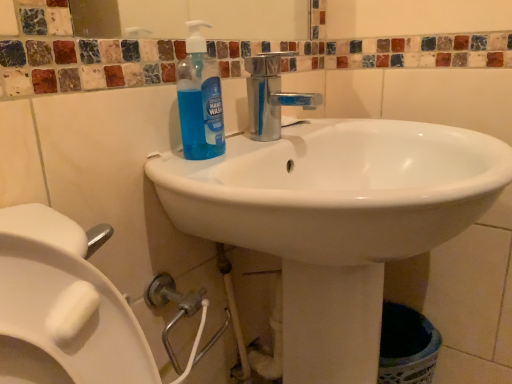
Question: Is point (343, 365) positioned closer to the camera than point (201, 41)?

Choices:
 (A) closer
 (B) farther

Answer: (B)

Question: In terms of width, does white glossy sink at center look wider or thinner when compared to blue translucent liquid at sink?

Choices:
 (A) thin
 (B) wide

Answer: (B)

Question: Is white glossy sink at center to the left or to the right of blue translucent liquid at sink in the image?

Choices:
 (A) right
 (B) left

Answer: (A)

Question: Is blue translucent liquid at sink wider or thinner than white glossy sink at center?

Choices:
 (A) thin
 (B) wide

Answer: (A)

Question: Is blue translucent liquid at sink bigger or smaller than white glossy sink at center?

Choices:
 (A) small
 (B) big

Answer: (A)

Question: From a real-world perspective, is blue translucent liquid at sink positioned above or below white glossy sink at center?

Choices:
 (A) below
 (B) above

Answer: (B)

Question: Is point (186, 130) closer or farther from the camera than point (488, 168)?

Choices:
 (A) farther
 (B) closer

Answer: (A)